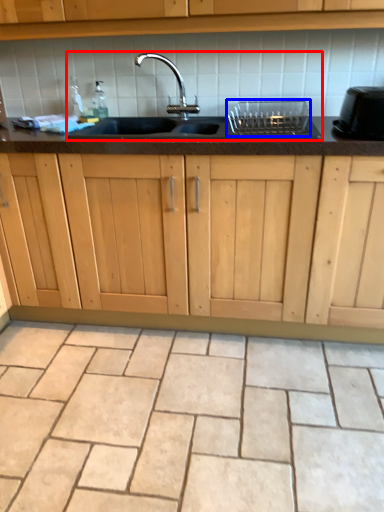
Question: Which object is further to the camera taking this photo, sink (highlighted by a red box) or appliance (highlighted by a blue box)?

Choices:
 (A) sink
 (B) appliance

Answer: (B)